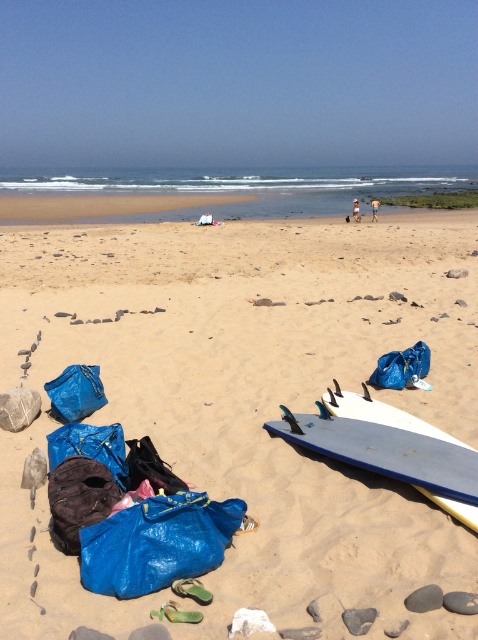
You are standing on the beach and see the blue tarp at lower left and the dark brown fabric bag at lower left. Which one is positioned more to the right side?

The blue tarp at lower left is positioned more to the right side than the dark brown fabric bag at lower left.

You are standing on the beach and want to retrieve the blue matte surfboard at lower center. However, there is a blue tarp at lower left in your path. Can you reach the surfboard without moving the tarp?

The blue tarp at lower left is closer to the viewer than the blue matte surfboard at lower center, so you would have to move the tarp first to access the surfboard.

You are a beachgoer who wants to cover your belongings with a large item. You see the blue tarp at lower left and the dark brown fabric bag at lower left. Which item can you use to cover your belongings more effectively?

The blue tarp at lower left is bigger than the dark brown fabric bag at lower left, so it can cover your belongings more effectively.